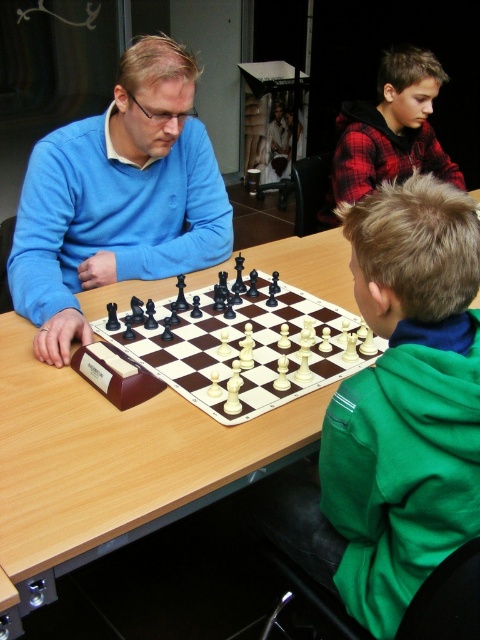
Question: Which object is closer to the camera taking this photo?

Choices:
 (A) green fleece jacket at lower right
 (B) matte plastic chess set at center

Answer: (A)

Question: Can you confirm if green fleece jacket at lower right is thinner than wooden table at center?

Choices:
 (A) yes
 (B) no

Answer: (A)

Question: Which point is closer to the camera?

Choices:
 (A) green fleece jacket at lower right
 (B) wooden table at center
 (C) matte plastic chess set at center

Answer: (A)

Question: Can you confirm if matte plastic chess set at center is positioned to the right of red plaid shirt at upper right?

Choices:
 (A) no
 (B) yes

Answer: (A)

Question: Which point is closer to the camera taking this photo?

Choices:
 (A) (131, 163)
 (B) (365, 131)
 (C) (414, 563)

Answer: (C)

Question: Does green fleece jacket at lower right appear on the left side of wooden table at center?

Choices:
 (A) no
 (B) yes

Answer: (A)